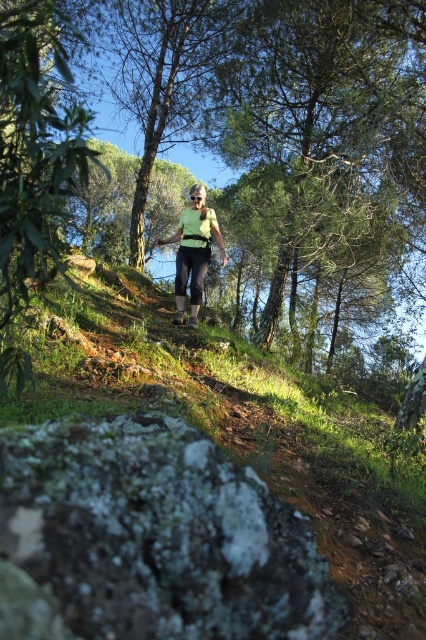
You are a hiker planning to take a photo of the green leafy tree at upper center and the green matte vest at center. Which object should you focus on first to ensure both are in focus?

To ensure both the green leafy tree at upper center and the green matte vest at center are in focus, you should focus on the green matte vest at center first since it is closer to the viewer than the green leafy tree at upper center.

You are a hiker planning to place a small first aid kit on the green mossy rock at lower left and the green matte vest at center. Which surface can hold the first aid kit more securely?

The green mossy rock at lower left is larger in size than the green matte vest at center, so it can hold the first aid kit more securely.